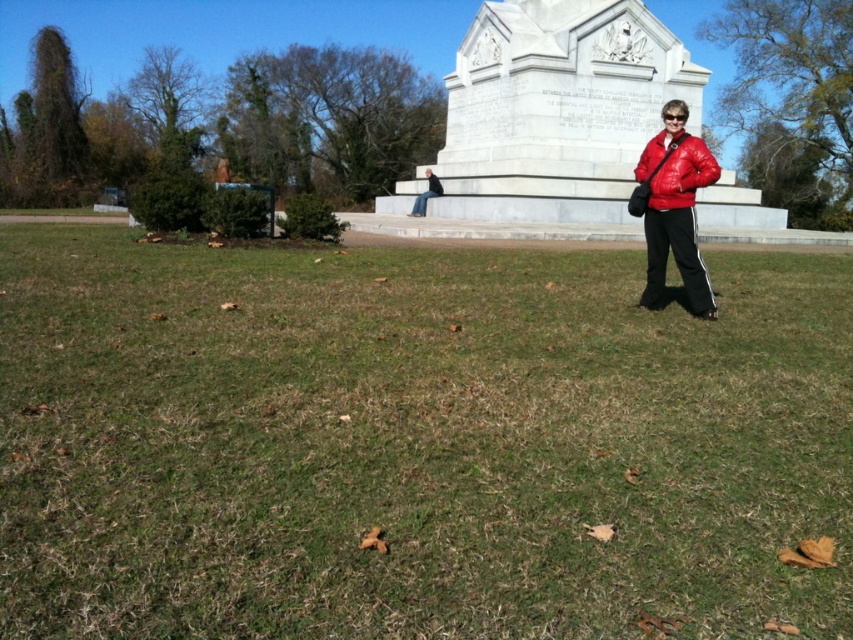
Question: Among these objects, which one is nearest to the camera?

Choices:
 (A) matte red jacket at right
 (B) dark blue jeans at center

Answer: (A)

Question: Is matte red jacket at right closer to the viewer compared to matte red jacket at center?

Choices:
 (A) yes
 (B) no

Answer: (B)

Question: Which object appears closest to the camera in this image?

Choices:
 (A) matte red jacket at center
 (B) dark blue jeans at center
 (C) matte red jacket at right
 (D) green grass at center

Answer: (D)

Question: Estimate the real-world distances between objects in this image. Which object is closer to the matte red jacket at center?

Choices:
 (A) matte red jacket at right
 (B) dark blue jeans at center

Answer: (A)

Question: Can you confirm if green grass at center is bigger than dark blue jeans at center?

Choices:
 (A) no
 (B) yes

Answer: (B)

Question: Is matte red jacket at right to the right of dark blue jeans at center from the viewer's perspective?

Choices:
 (A) no
 (B) yes

Answer: (B)